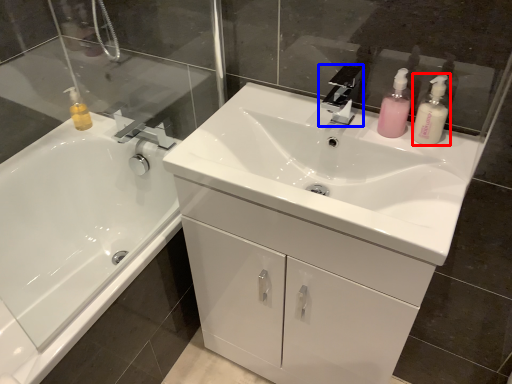
Question: Which object appears closest to the camera in this image, toiletry (highlighted by a red box) or tap (highlighted by a blue box)?

Choices:
 (A) toiletry
 (B) tap

Answer: (A)